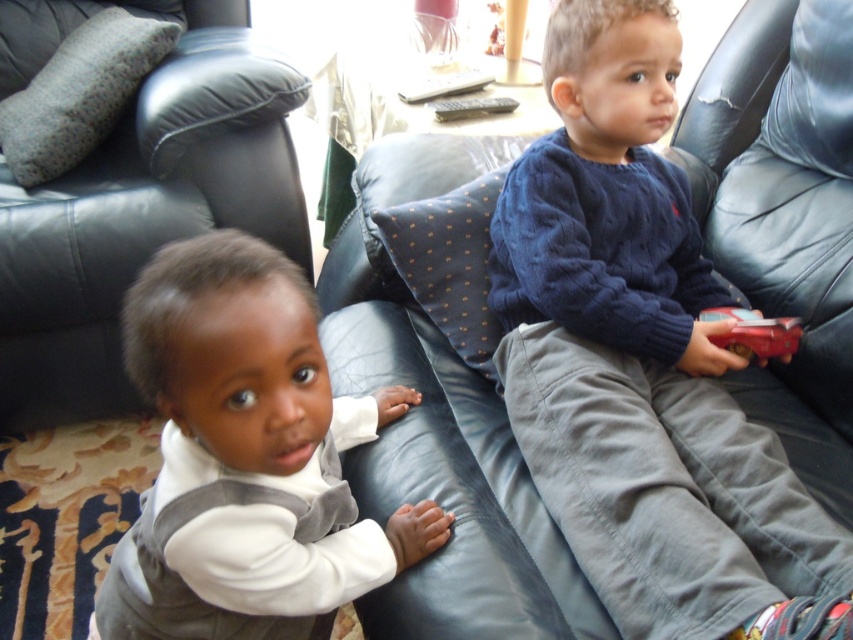
Question: Which object is the farthest from the cable-knit sweater at center?

Choices:
 (A) white soft vest at lower left
 (B) black plastic remote at center

Answer: (B)

Question: Which object is positioned farthest from the red plastic car at right?

Choices:
 (A) white soft vest at lower left
 (B) black plastic remote at center

Answer: (B)

Question: Which point is closer to the camera?

Choices:
 (A) (721, 301)
 (B) (438, 116)
 (C) (792, 324)

Answer: (C)

Question: Is white soft vest at lower left to the right of red plastic car at right from the viewer's perspective?

Choices:
 (A) no
 (B) yes

Answer: (A)

Question: From the image, what is the correct spatial relationship of white soft vest at lower left in relation to black plastic remote at center?

Choices:
 (A) right
 (B) left

Answer: (B)

Question: Where is white soft vest at lower left located in relation to red plastic car at right in the image?

Choices:
 (A) above
 (B) below

Answer: (B)